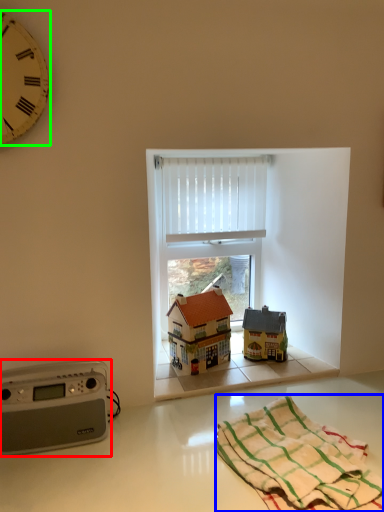
Question: Based on their relative distances, which object is farther from stereo (highlighted by a red box)? Choose from blanket (highlighted by a blue box) and clock (highlighted by a green box).

Choices:
 (A) blanket
 (B) clock

Answer: (B)